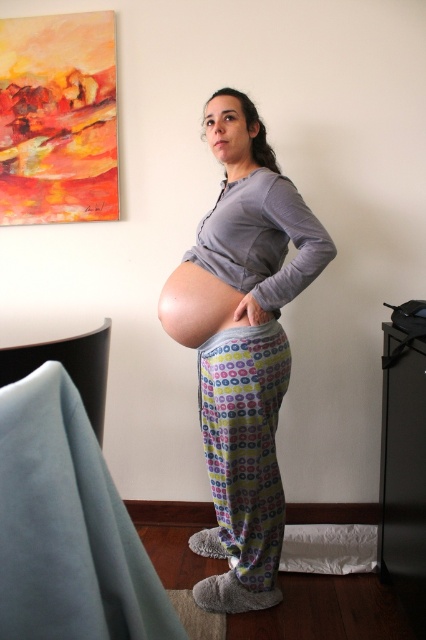
You are a photographer positioned in front of the pregnant woman wearing a matte gray sweatshirt at center. You want to capture a closeup shot of her face without any distortion. Considering your current distance, is it feasible to do so without moving closer?

The matte gray sweatshirt at center is 1.73 meters away from the viewer. Since this distance allows for a clear closeup shot of the face using a standard lens without causing distortion, it is feasible to capture the desired image without moving closer.

Based on the scene description, can you determine which clothing item is closer to the viewer between the matte gray sweatshirt at center and the printed cotton leggings at center?

The matte gray sweatshirt at center is closer to the viewer since it is in front of the printed cotton leggings at center.